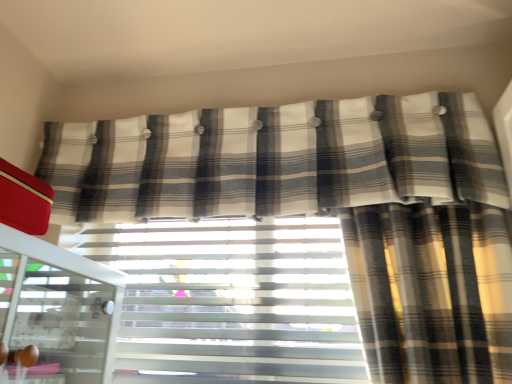
Identify the location of plaid fabric curtain at upper center. The image size is (512, 384). click(x=274, y=159).

Identify the location of white textured blinds at center. This screenshot has width=512, height=384. (232, 301).

Where is `plaid fabric curtain at upper center`? This screenshot has width=512, height=384. plaid fabric curtain at upper center is located at coordinates (274, 159).

From a real-world perspective, which is physically above, plaid fabric curtain at upper center or white glossy screen door at left?

From a 3D spatial view, plaid fabric curtain at upper center is above.

From the image's perspective, relative to white glossy screen door at left, is plaid fabric curtain at upper center above or below?

Clearly, from the image's perspective, plaid fabric curtain at upper center is above white glossy screen door at left.

Considering the relative sizes of plaid fabric curtain at upper center and white glossy screen door at left in the image provided, is plaid fabric curtain at upper center bigger than white glossy screen door at left?

Indeed, plaid fabric curtain at upper center has a larger size compared to white glossy screen door at left.

Is plaid fabric curtain at upper center located outside white glossy screen door at left?

That's correct, plaid fabric curtain at upper center is outside of white glossy screen door at left.

Is white textured blinds at center positioned behind white glossy screen door at left?

Yes, it is.

From the image's perspective, who appears lower, white textured blinds at center or white glossy screen door at left?

From the image's view, white textured blinds at center is below.

From a real-world perspective, relative to white glossy screen door at left, is white textured blinds at center vertically above or below?

In terms of real-world spatial position, white textured blinds at center is above white glossy screen door at left.

Looking at this image, which of these two, white glossy screen door at left or white textured blinds at center, is smaller?

white textured blinds at center is smaller.

Does white glossy screen door at left turn towards white textured blinds at center?

No, white glossy screen door at left is not aimed at white textured blinds at center.

In the scene shown: How far apart are white glossy screen door at left and white textured blinds at center?

white glossy screen door at left is 35.46 centimeters away from white textured blinds at center.

Would you say white glossy screen door at left is a long distance from white textured blinds at center?

white glossy screen door at left is actually quite close to white textured blinds at center.

Can you confirm if plaid fabric curtain at upper center is thinner than white textured blinds at center?

No.

Consider the image. From a real-world perspective, which is physically below, plaid fabric curtain at upper center or white textured blinds at center?

From a 3D spatial view, white textured blinds at center is below.

Is plaid fabric curtain at upper center positioned beyond the bounds of white textured blinds at center?

That's correct, plaid fabric curtain at upper center is outside of white textured blinds at center.

Is point (260, 324) behind point (199, 210)?

Yes, it is behind point (199, 210).

Is white textured blinds at center taller than plaid fabric curtain at upper center?

Yes.

Is white textured blinds at center in front of or behind plaid fabric curtain at upper center in the image?

white textured blinds at center is behind plaid fabric curtain at upper center.

Measure the distance between white glossy screen door at left and plaid fabric curtain at upper center.

They are 46.52 centimeters apart.

From a real-world perspective, who is located lower, white glossy screen door at left or plaid fabric curtain at upper center?

white glossy screen door at left is physically lower.

Which is more to the left, white glossy screen door at left or plaid fabric curtain at upper center?

From the viewer's perspective, white glossy screen door at left appears more on the left side.

Is white glossy screen door at left situated inside plaid fabric curtain at upper center or outside?

white glossy screen door at left lies outside plaid fabric curtain at upper center.

At what (x,y) coordinates should I click in order to perform the action: click on curtain behind the white glossy screen door at left. Please return your answer as a coordinate pair (x, y). This screenshot has height=384, width=512. Looking at the image, I should click on (274, 159).

You are a GUI agent. You are given a task and a screenshot of the screen. Output one action in this format:
    pyautogui.click(x=<x>, y=<y>)
    Task: Click on the screen door in front of the white textured blinds at center
    
    Given the screenshot: What is the action you would take?
    pyautogui.click(x=54, y=322)

Which object lies nearer to the anchor point white glossy screen door at left, plaid fabric curtain at upper center or white textured blinds at center?

The object closer to white glossy screen door at left is white textured blinds at center.

In the scene shown: Looking at the image, which one is located closer to plaid fabric curtain at upper center, white glossy screen door at left or white textured blinds at center?

white textured blinds at center.

Considering their positions, is white glossy screen door at left positioned closer to white textured blinds at center than plaid fabric curtain at upper center?

plaid fabric curtain at upper center is closer to white textured blinds at center.

Based on their spatial positions, is white textured blinds at center or plaid fabric curtain at upper center further from white glossy screen door at left?

plaid fabric curtain at upper center.

Looking at the image, which one is located further to plaid fabric curtain at upper center, white textured blinds at center or white glossy screen door at left?

Based on the image, white glossy screen door at left appears to be further to plaid fabric curtain at upper center.

Consider the image. When comparing their distances from white textured blinds at center, does plaid fabric curtain at upper center or white glossy screen door at left seem closer?

The object closer to white textured blinds at center is plaid fabric curtain at upper center.

Where is `window blind between white glossy screen door at left and plaid fabric curtain at upper center`? This screenshot has width=512, height=384. window blind between white glossy screen door at left and plaid fabric curtain at upper center is located at coordinates (232, 301).